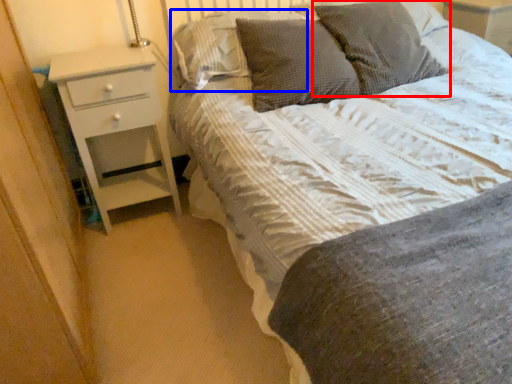
Question: Which object is further to the camera taking this photo, pillow (highlighted by a red box) or pillow (highlighted by a blue box)?

Choices:
 (A) pillow
 (B) pillow

Answer: (B)